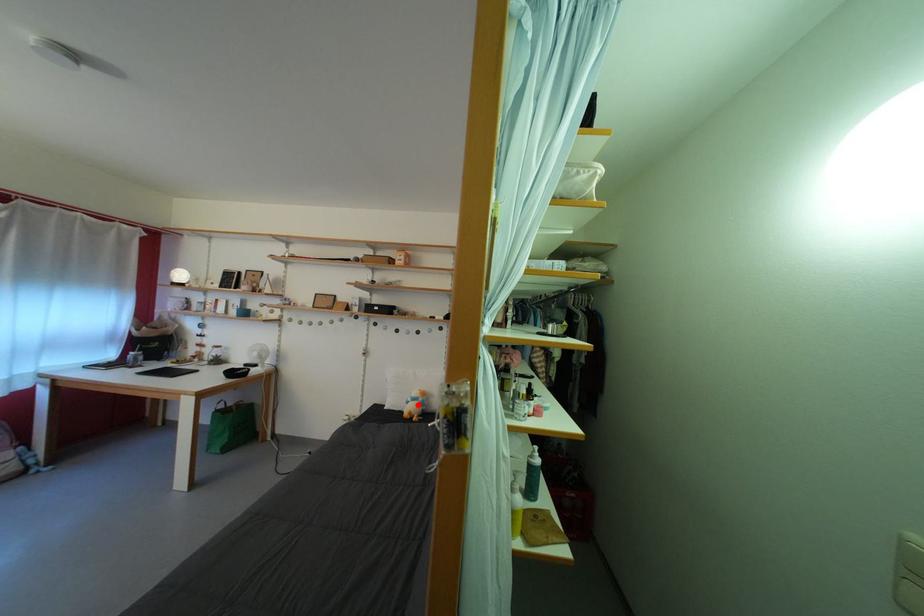
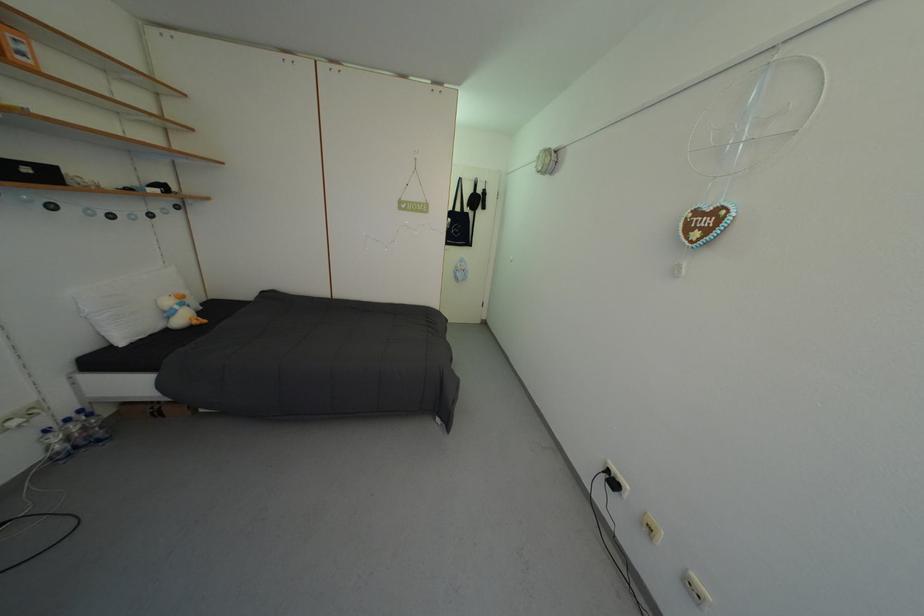
Question: A red point is marked in image1. In image2, is the corresponding 3D point closer to the camera or farther? Reply with the corresponding letter.

Choices:
 (A) The corresponding 3D point is closer.
 (B) The corresponding 3D point is farther.

Answer: (A)